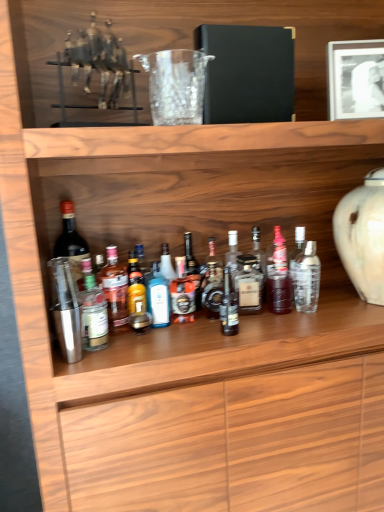
Identify the location of clear glass bottle at center, the thirteenth bottle positioned from the left. This screenshot has height=512, width=384. (306, 278).

The image size is (384, 512). Find the location of `metallic silver shaker at center-left, positioned as the 12th bottle in right-to-left order`. metallic silver shaker at center-left, positioned as the 12th bottle in right-to-left order is located at coordinates (93, 315).

What do you see at coordinates (229, 306) in the screenshot?
I see `matte glass bottle at center, which is the fifth bottle from right to left` at bounding box center [229, 306].

Where is `translucent glass bottle at center, marked as the 4th bottle in a left-to-right arrangement`? translucent glass bottle at center, marked as the 4th bottle in a left-to-right arrangement is located at coordinates (137, 303).

Describe the element at coordinates (158, 297) in the screenshot. I see `translucent glass bottle at center, which appears as the 9th bottle when viewed from the right` at that location.

The width and height of the screenshot is (384, 512). Identify the location of clear glass bottle at center, the first bottle in the right-to-left sequence. (306, 278).

Considering the positions of objects black glass bottle at center, which ranks as the seventh bottle in left-to-right order, and metallic silver shaker at center-left, the 2th bottle when ordered from left to right, in the image provided, who is in front, black glass bottle at center, which ranks as the seventh bottle in left-to-right order, or metallic silver shaker at center-left, the 2th bottle when ordered from left to right,?

metallic silver shaker at center-left, the 2th bottle when ordered from left to right, is more forward.

From the image's perspective, starting from the metallic silver shaker at center-left, positioned as the 12th bottle in right-to-left order, which bottle is the 10th one above? Please provide its 2D coordinates.

[(192, 268)]

From the image's perspective, is black glass bottle at center, acting as the 7th bottle starting from the right, located above or below metallic silver shaker at center-left, the 2th bottle when ordered from left to right?

black glass bottle at center, acting as the 7th bottle starting from the right, is situated higher than metallic silver shaker at center-left, the 2th bottle when ordered from left to right, in the image.

In the scene shown: Considering the sizes of objects clear glass bottle at center, the thirteenth bottle positioned from the left, and metallic silver horse at upper left in the image provided, who is smaller, clear glass bottle at center, the thirteenth bottle positioned from the left, or metallic silver horse at upper left?

clear glass bottle at center, the thirteenth bottle positioned from the left.

From the picture: Is clear glass bottle at center, the first bottle in the right-to-left sequence, far from metallic silver horse at upper left?

No.

Considering the positions of points (299, 282) and (133, 91), is point (299, 282) farther from camera compared to point (133, 91)?

Yes, it is behind point (133, 91).

Does transparent glass at center turn towards metallic silver horse at upper left?

No, transparent glass at center does not turn towards metallic silver horse at upper left.

Is transparent glass at center beside metallic silver horse at upper left?

No, transparent glass at center is not making contact with metallic silver horse at upper left.

Is transparent glass at center positioned in front of metallic silver horse at upper left?

No, it is behind metallic silver horse at upper left.

Locate an element on the screen. Image resolution: width=384 pixels, height=512 pixels. glass vase that is below the metallic silver horse at upper left (from the image's perspective) is located at coordinates tap(176, 85).

From the picture: Which object is positioned more to the left, metallic silver shaker at center-left, the 2th bottle when ordered from left to right, or metallic silver horse at upper left?

metallic silver shaker at center-left, the 2th bottle when ordered from left to right, is more to the left.

Would you say metallic silver horse at upper left is part of metallic silver shaker at center-left, the 2th bottle when ordered from left to right,'s contents?

No, metallic silver horse at upper left is not inside metallic silver shaker at center-left, the 2th bottle when ordered from left to right.

From the image's perspective, which is below, metallic silver shaker at center-left, the 2th bottle when ordered from left to right, or metallic silver horse at upper left?

metallic silver shaker at center-left, the 2th bottle when ordered from left to right.

From the picture: Could you measure the distance between metallic silver shaker at center-left, positioned as the 12th bottle in right-to-left order, and metallic silver horse at upper left?

The distance of metallic silver shaker at center-left, positioned as the 12th bottle in right-to-left order, from metallic silver horse at upper left is 61.57 centimeters.

Considering the sizes of objects clear glass bottle at center, the first bottle in the right-to-left sequence, and matte black bottle at left, the thirteenth bottle from the right, in the image provided, who is wider, clear glass bottle at center, the first bottle in the right-to-left sequence, or matte black bottle at left, the thirteenth bottle from the right,?

With larger width is matte black bottle at left, the thirteenth bottle from the right.

Which object is further away from the camera, clear glass bottle at center, the thirteenth bottle positioned from the left, or matte black bottle at left, the thirteenth bottle from the right?

Positioned behind is clear glass bottle at center, the thirteenth bottle positioned from the left.

Is clear glass bottle at center, the first bottle in the right-to-left sequence, far away from matte black bottle at left, placed as the first bottle when sorted from left to right?

No, there isn't a large distance between clear glass bottle at center, the first bottle in the right-to-left sequence, and matte black bottle at left, placed as the first bottle when sorted from left to right.

In terms of size, does matte black bottle at left, placed as the first bottle when sorted from left to right, appear bigger or smaller than translucent glass bottle at center, marked as the 4th bottle in a left-to-right arrangement?

Clearly, matte black bottle at left, placed as the first bottle when sorted from left to right, is larger in size than translucent glass bottle at center, marked as the 4th bottle in a left-to-right arrangement.

Is matte black bottle at left, the thirteenth bottle from the right, positioned far away from translucent glass bottle at center, marked as the 4th bottle in a left-to-right arrangement?

They are positioned close to each other.

Find the location of a particular element. The height and width of the screenshot is (512, 384). the 12th bottle positioned above the translucent glass bottle at center, the 10th bottle from the right (from a real-world perspective) is located at coordinates (71, 243).

Which object is further away from the camera taking this photo, matte black bottle at left, the thirteenth bottle from the right, or translucent glass bottle at center, marked as the 4th bottle in a left-to-right arrangement?

translucent glass bottle at center, marked as the 4th bottle in a left-to-right arrangement, is further away from the camera.

Is translucent glass bottle at center, the 6th bottle when ordered from left to right, facing towards matte black bottle at left, the thirteenth bottle from the right?

No, translucent glass bottle at center, the 6th bottle when ordered from left to right, is not oriented towards matte black bottle at left, the thirteenth bottle from the right.

From the image's perspective, between translucent glass bottle at center, the 6th bottle when ordered from left to right, and matte black bottle at left, the thirteenth bottle from the right, who is located below?

From the image's view, translucent glass bottle at center, the 6th bottle when ordered from left to right, is below.

Is matte black bottle at left, placed as the first bottle when sorted from left to right, inside translucent glass bottle at center, the 6th bottle when ordered from left to right?

No.

The image size is (384, 512). Find the location of `the 11th bottle behind the metallic silver shaker at center-left, the 2th bottle when ordered from left to right, counting from the anchor's position`. the 11th bottle behind the metallic silver shaker at center-left, the 2th bottle when ordered from left to right, counting from the anchor's position is located at coordinates (192, 268).

From the image's perspective, count 5th bottles downward from the metallic silver horse at upper left and point to it. Please provide its 2D coordinates.

[(306, 278)]

Based on their spatial positions, is matte glass bottle at center, which is the fifth bottle from right to left, or matte black bottle at left, the thirteenth bottle from the right, further from translucent glass bottle at center, the 10th bottle from the right?

matte glass bottle at center, which is the fifth bottle from right to left.

When comparing their distances from translucent glass bottle at center, the fifth bottle when ordered from left to right, does matte glass bottle at center, which appears as the ninth bottle when viewed from the left, or white glossy vase at right seem further?

white glossy vase at right lies further to translucent glass bottle at center, the fifth bottle when ordered from left to right, than the other object.

Considering their positions, is translucent glass bottle at center, the 6th bottle when ordered from left to right, positioned further to clear glass bottle at center, the first bottle in the right-to-left sequence, than metallic silver horse at upper left?

metallic silver horse at upper left.

Looking at the image, which one is located closer to translucent glass bottle at center, which ranks as the 3th bottle in right-to-left order, translucent glass bottle at center, marked as the 4th bottle in a left-to-right arrangement, or translucent glass bottle at center, which appears as the 3th bottle when viewed from the left?

translucent glass bottle at center, marked as the 4th bottle in a left-to-right arrangement, is closer to translucent glass bottle at center, which ranks as the 3th bottle in right-to-left order.

Which object lies nearer to the anchor point matte black bottle at left, the thirteenth bottle from the right, metallic silver shaker at center-left, positioned as the 12th bottle in right-to-left order, or transparent glass at center?

metallic silver shaker at center-left, positioned as the 12th bottle in right-to-left order, is closer to matte black bottle at left, the thirteenth bottle from the right.

Estimate the real-world distances between objects in this image. Which object is further from clear glass bottle at center, the thirteenth bottle positioned from the left, black glass bottle at center, acting as the 7th bottle starting from the right, or metallic silver shaker at center-left, positioned as the 12th bottle in right-to-left order?

metallic silver shaker at center-left, positioned as the 12th bottle in right-to-left order, is further to clear glass bottle at center, the thirteenth bottle positioned from the left.

From the image, which object appears to be nearer to clear glass bottle at center, the thirteenth bottle positioned from the left, black glass bottle at center, which ranks as the seventh bottle in left-to-right order, or clear glass bottle at center, which is the 2th bottle from right to left?

Based on the image, clear glass bottle at center, which is the 2th bottle from right to left, appears to be nearer to clear glass bottle at center, the thirteenth bottle positioned from the left.

From the image, which object appears to be nearer to translucent glass bottle at center, arranged as the 11th bottle when viewed from the right, white matte picture frame at upper right or shiny gold bottle at center, the eighth bottle in the left-to-right sequence?

shiny gold bottle at center, the eighth bottle in the left-to-right sequence, is positioned closer to the anchor translucent glass bottle at center, arranged as the 11th bottle when viewed from the right.

Locate an element on the screen. The image size is (384, 512). glass vase between metallic silver horse at upper left and translucent glass bottle at center, which appears as the 9th bottle when viewed from the right, vertically is located at coordinates (176, 85).

This screenshot has width=384, height=512. What are the coordinates of `glass vase situated between translucent glass bottle at center, arranged as the 11th bottle when viewed from the right, and white matte picture frame at upper right from left to right` in the screenshot? It's located at click(x=176, y=85).

Where is `picture frame situated between black glass bottle at center, which ranks as the seventh bottle in left-to-right order, and white glossy vase at right from left to right`? This screenshot has width=384, height=512. picture frame situated between black glass bottle at center, which ranks as the seventh bottle in left-to-right order, and white glossy vase at right from left to right is located at coordinates (355, 79).

Image resolution: width=384 pixels, height=512 pixels. I want to click on picture frame situated between translucent glass bottle at center, which is counted as the eighth bottle, starting from the right, and white glossy vase at right from left to right, so click(355, 79).